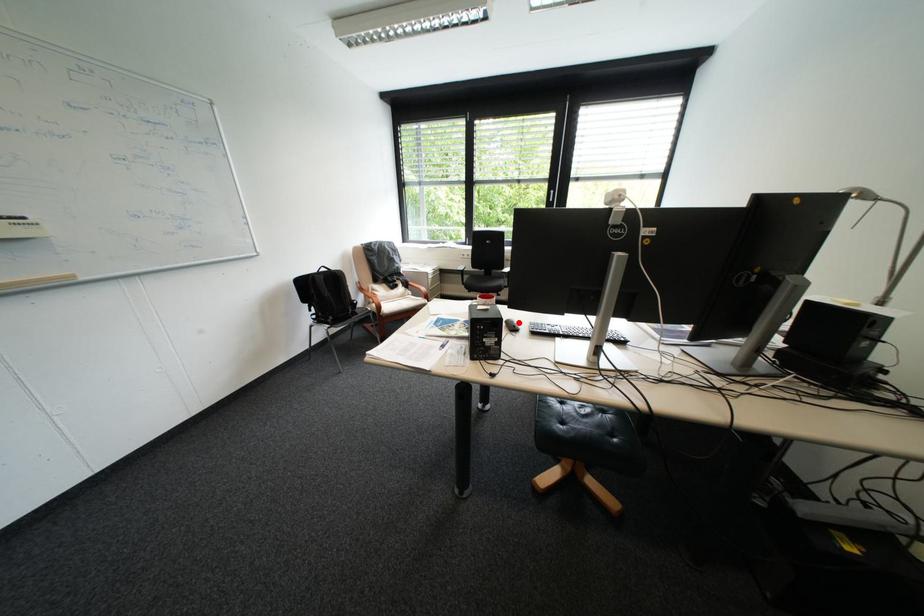
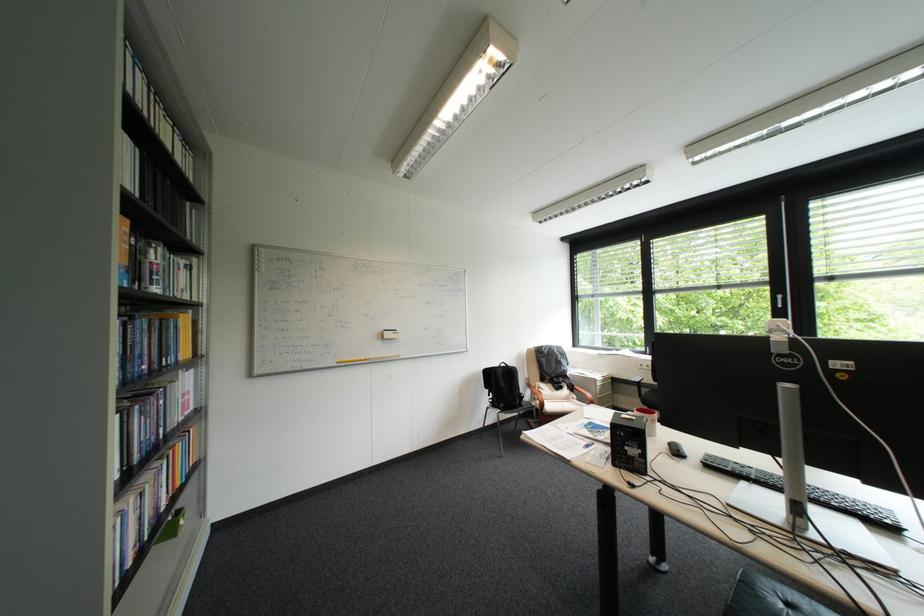
Find the pixel in the second image that matches the highlighted location in the first image.

(682, 445)